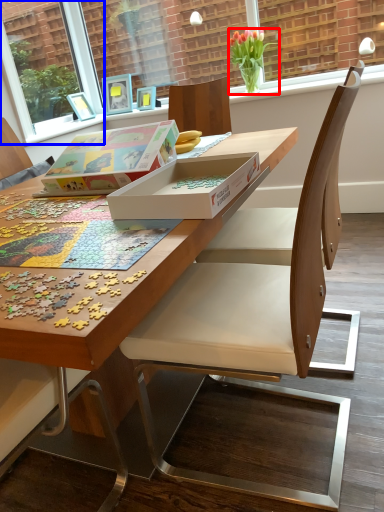
Question: Which object is further to the camera taking this photo, houseplant (highlighted by a red box) or window screen (highlighted by a blue box)?

Choices:
 (A) houseplant
 (B) window screen

Answer: (B)